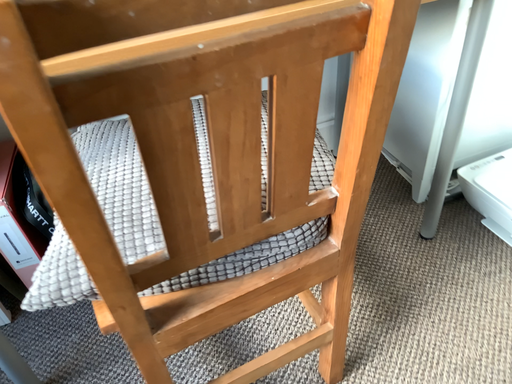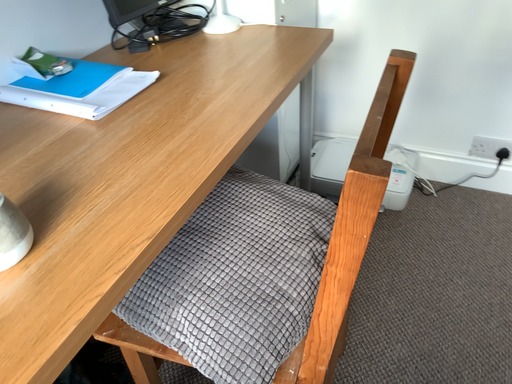
Question: Which way did the camera rotate in the video?

Choices:
 (A) rotated downward
 (B) rotated upward

Answer: (B)